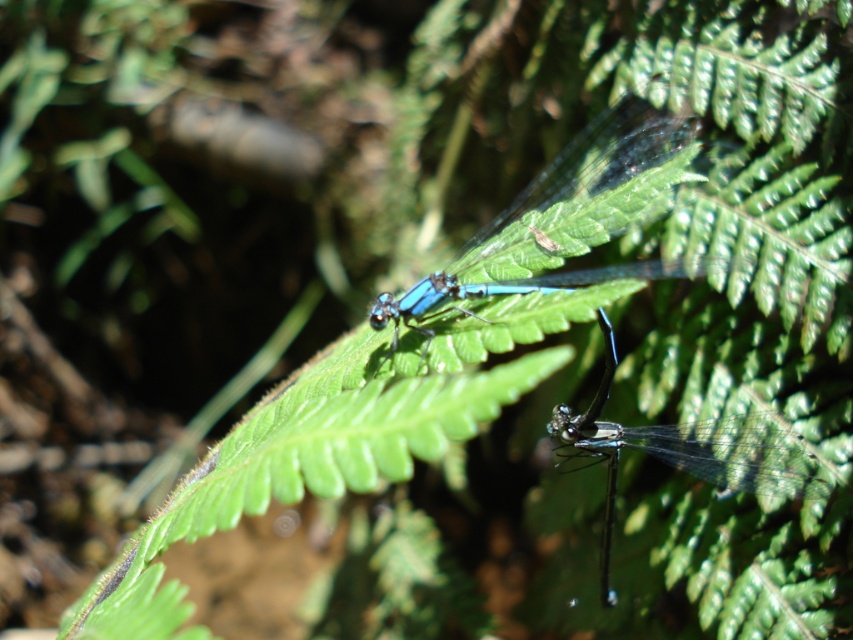
Is blue translucent dragonfly at center thinner than transparent glass dragonfly at center?

No.

Is point (640, 276) more distant than point (717, 484)?

Yes.

Where is `blue translucent dragonfly at center`? The height and width of the screenshot is (640, 853). blue translucent dragonfly at center is located at coordinates (547, 212).